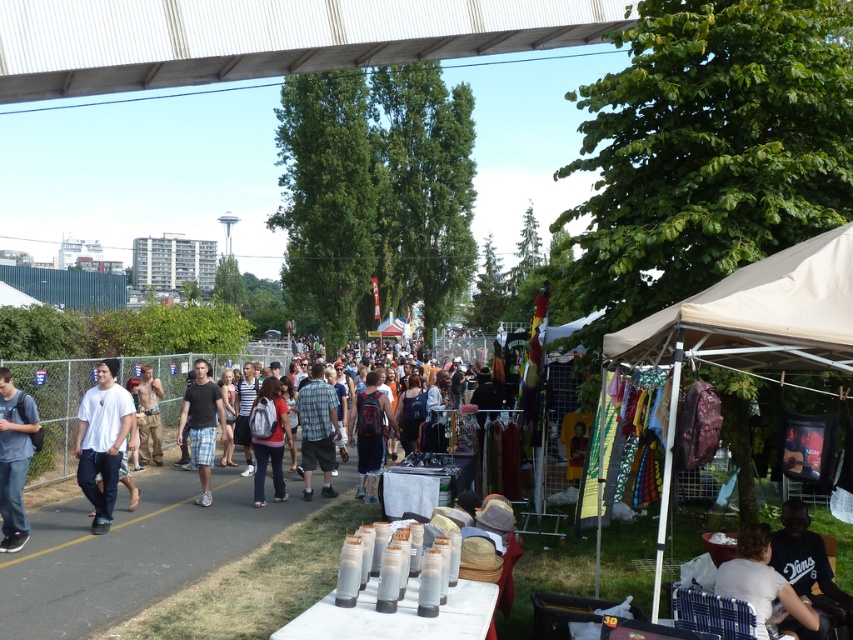
Is beige fabric tent at right taller than white cotton t-shirt at left?

Indeed, beige fabric tent at right has a greater height compared to white cotton t-shirt at left.

Who is positioned more to the left, beige fabric tent at right or white cotton t-shirt at left?

From the viewer's perspective, white cotton t-shirt at left appears more on the left side.

Between point (717, 288) and point (125, 413), which one is positioned behind?

Positioned behind is point (125, 413).

Where is `beige fabric tent at right`? beige fabric tent at right is located at coordinates (751, 326).

Is dark brown leather jacket at lower right bigger than plaid fabric shirt at center?

No, dark brown leather jacket at lower right is not bigger than plaid fabric shirt at center.

Which is above, dark brown leather jacket at lower right or plaid fabric shirt at center?

Positioned higher is plaid fabric shirt at center.

The height and width of the screenshot is (640, 853). What do you see at coordinates (808, 564) in the screenshot? I see `dark brown leather jacket at lower right` at bounding box center [808, 564].

This screenshot has height=640, width=853. I want to click on dark brown leather jacket at lower right, so click(808, 564).

Which is more to the left, beige fabric tent at right or white fabric shirt at lower right?

Positioned to the left is beige fabric tent at right.

Who is positioned more to the right, beige fabric tent at right or white fabric shirt at lower right?

white fabric shirt at lower right is more to the right.

You are a GUI agent. You are given a task and a screenshot of the screen. Output one action in this format:
    pyautogui.click(x=<x>, y=<y>)
    Task: Click on the beige fabric tent at right
    
    Given the screenshot: What is the action you would take?
    pyautogui.click(x=751, y=326)